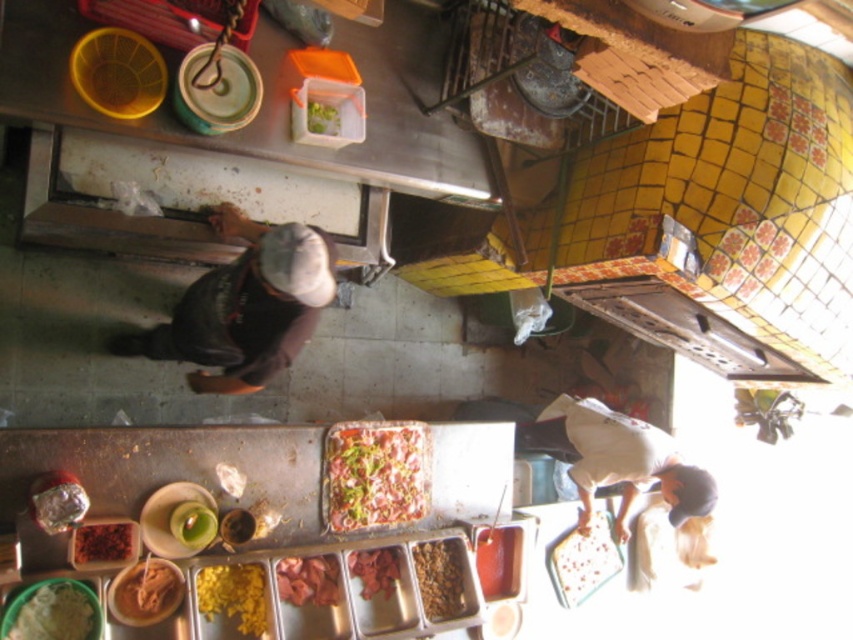
Can you confirm if spotted white plate at lower right is taller than shiny red meat at center?

Indeed, spotted white plate at lower right has a greater height compared to shiny red meat at center.

Which is more to the right, spotted white plate at lower right or shiny red meat at center?

spotted white plate at lower right is more to the right.

Where is `spotted white plate at lower right`? spotted white plate at lower right is located at coordinates (584, 561).

Can you confirm if green matte rice at lower left is positioned above shiny brown meat at center?

Yes.

Is the position of green matte rice at lower left more distant than that of shiny brown meat at center?

That is False.

Image resolution: width=853 pixels, height=640 pixels. What are the coordinates of `green matte rice at lower left` in the screenshot? It's located at pos(51,612).

Which is above, dark brown fabric at center or spotted white plate at lower right?

dark brown fabric at center is above.

Is dark brown fabric at center shorter than spotted white plate at lower right?

In fact, dark brown fabric at center may be taller than spotted white plate at lower right.

Where is `dark brown fabric at center`? dark brown fabric at center is located at coordinates (245, 307).

The width and height of the screenshot is (853, 640). What are the coordinates of `dark brown fabric at center` in the screenshot? It's located at (245, 307).